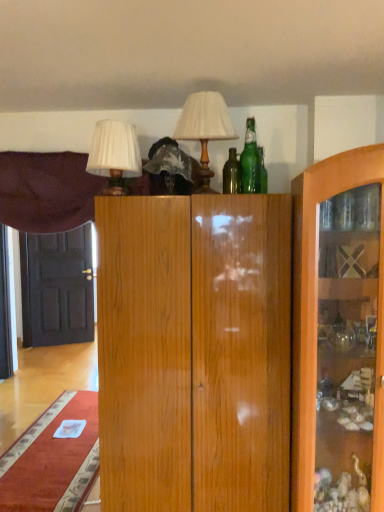
Question: Is matte white lampshade at upper center, arranged as the 2th table lamp when viewed from the left, at the right side of green glass bottle at upper center?

Choices:
 (A) yes
 (B) no

Answer: (B)

Question: Does matte white lampshade at upper center, the 1th table lamp positioned from the right, have a greater height compared to green glass bottle at upper center?

Choices:
 (A) no
 (B) yes

Answer: (B)

Question: Is matte white lampshade at upper center, arranged as the 2th table lamp when viewed from the left, located outside green glass bottle at upper center?

Choices:
 (A) yes
 (B) no

Answer: (A)

Question: Considering the relative sizes of matte white lampshade at upper center, arranged as the 2th table lamp when viewed from the left, and green glass bottle at upper center in the image provided, is matte white lampshade at upper center, arranged as the 2th table lamp when viewed from the left, thinner than green glass bottle at upper center?

Choices:
 (A) no
 (B) yes

Answer: (A)

Question: Is green glass bottle at upper center completely or partially inside matte white lampshade at upper center, the 1th table lamp positioned from the right?

Choices:
 (A) yes
 (B) no

Answer: (B)

Question: Could you tell me if matte white lampshade at upper center, the 1th table lamp positioned from the right, is turned towards green glass bottle at upper center?

Choices:
 (A) yes
 (B) no

Answer: (B)

Question: Does green glass bottle at upper center have a larger size compared to velvet purple curtain at upper left?

Choices:
 (A) yes
 (B) no

Answer: (B)

Question: From a real-world perspective, is green glass bottle at upper center under velvet purple curtain at upper left?

Choices:
 (A) no
 (B) yes

Answer: (A)

Question: Considering the relative positions of green glass bottle at upper center and velvet purple curtain at upper left in the image provided, is green glass bottle at upper center behind velvet purple curtain at upper left?

Choices:
 (A) yes
 (B) no

Answer: (B)

Question: Can you confirm if green glass bottle at upper center is wider than velvet purple curtain at upper left?

Choices:
 (A) yes
 (B) no

Answer: (B)

Question: Is green glass bottle at upper center to the left of velvet purple curtain at upper left from the viewer's perspective?

Choices:
 (A) no
 (B) yes

Answer: (A)

Question: From the image's perspective, is green glass bottle at upper center located above velvet purple curtain at upper left?

Choices:
 (A) yes
 (B) no

Answer: (A)

Question: Is velvet purple curtain at upper left in contact with black glossy door at left?

Choices:
 (A) no
 (B) yes

Answer: (A)